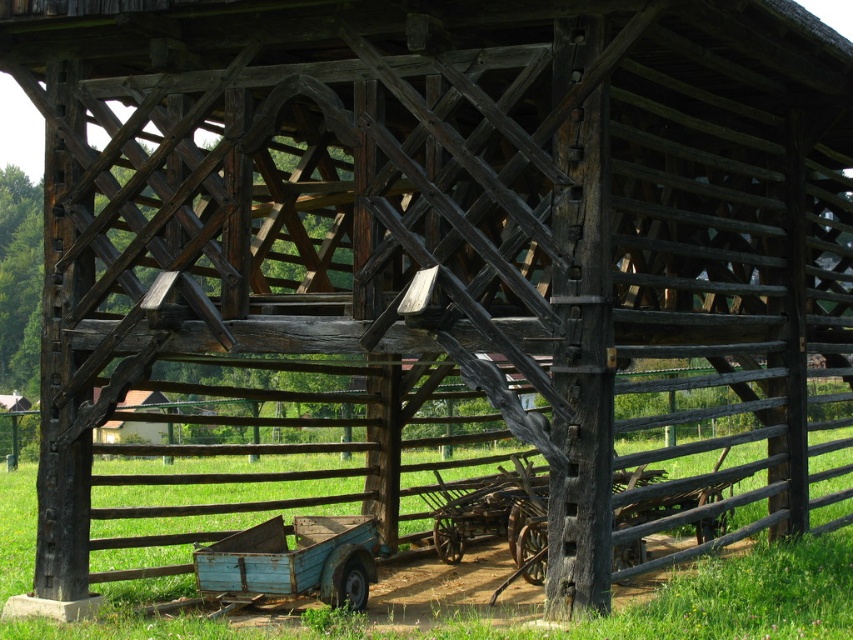
Question: Can you confirm if rusty wooden wagon at lower center is smaller than brown wooden fence at center?

Choices:
 (A) yes
 (B) no

Answer: (A)

Question: Can you confirm if rusty wooden wagon at lower center is bigger than brown wooden fence at center?

Choices:
 (A) yes
 (B) no

Answer: (B)

Question: Can you confirm if rusty wooden wagon at lower center is positioned to the left of brown wooden fence at center?

Choices:
 (A) yes
 (B) no

Answer: (A)

Question: Which object appears closest to the camera in this image?

Choices:
 (A) brown wooden fence at center
 (B) rusty wooden wagon at lower center

Answer: (A)

Question: Which object is closer to the camera taking this photo?

Choices:
 (A) brown wooden fence at center
 (B) rusty wooden wagon at lower center

Answer: (A)